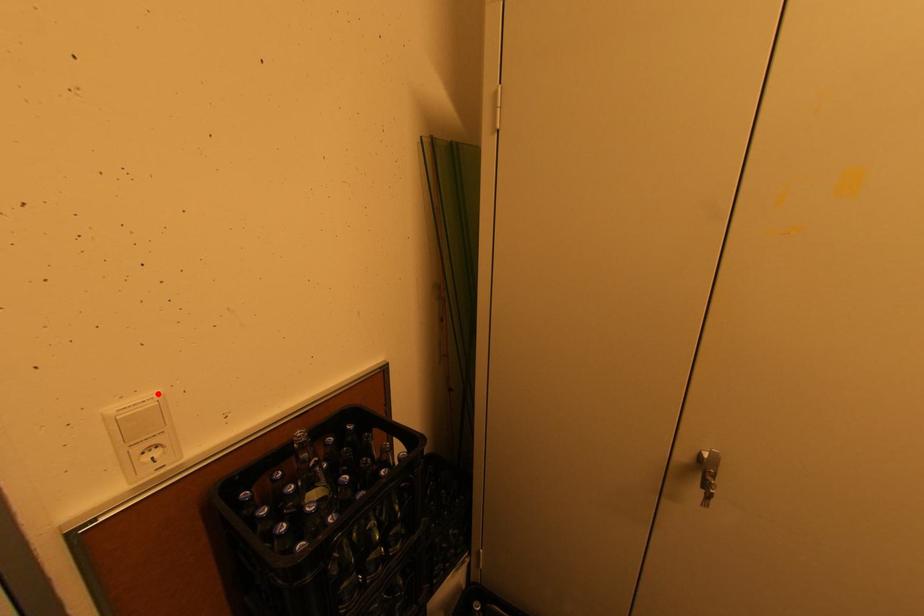
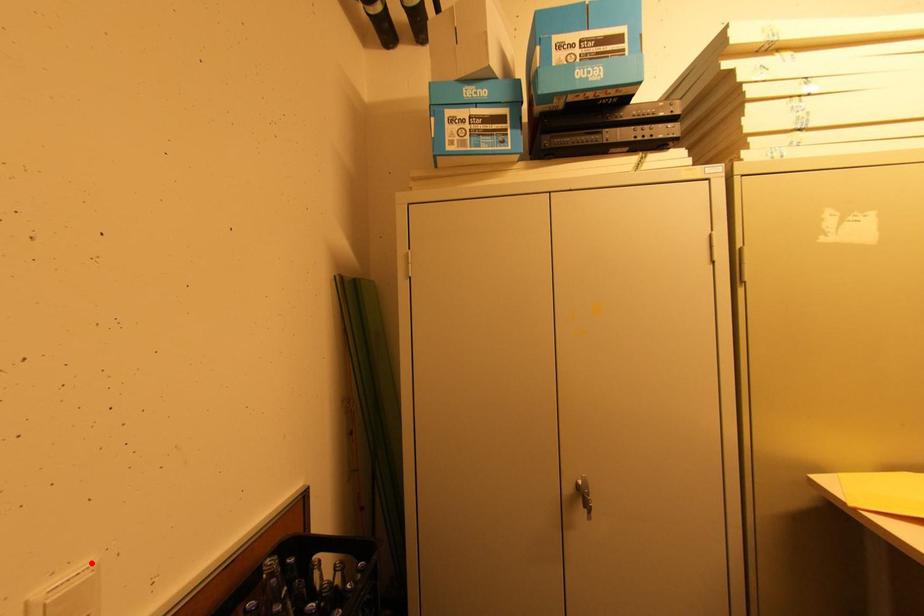
I am providing you with two images of the same scene from different viewpoints. A red point is marked on the first image and another point is marked on the second image. Does the point marked in image1 correspond to the same location as the one in image2?

Yes